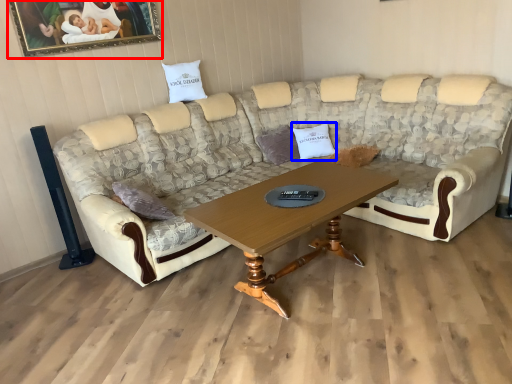
Question: Among these objects, which one is nearest to the camera, picture frame (highlighted by a red box) or pillow (highlighted by a blue box)?

Choices:
 (A) picture frame
 (B) pillow

Answer: (A)